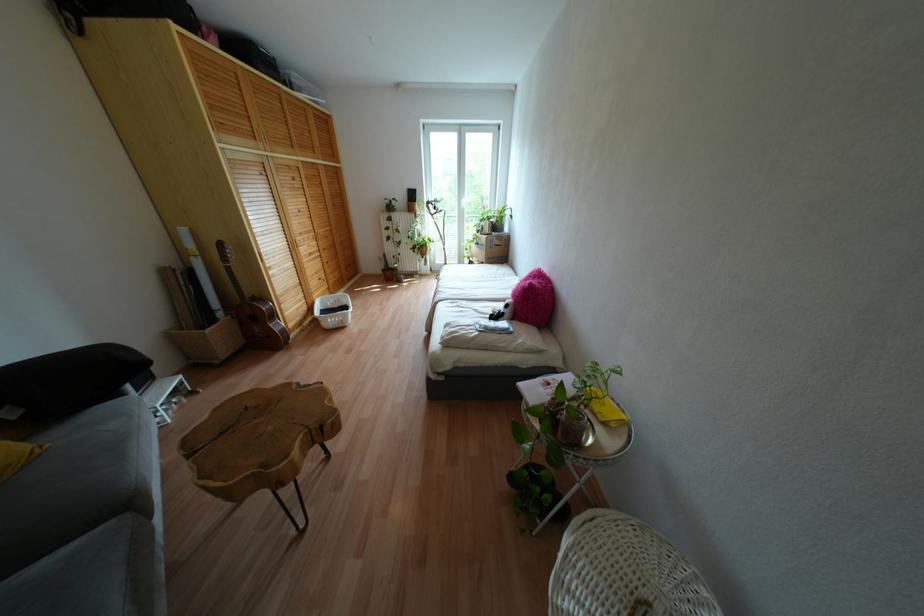
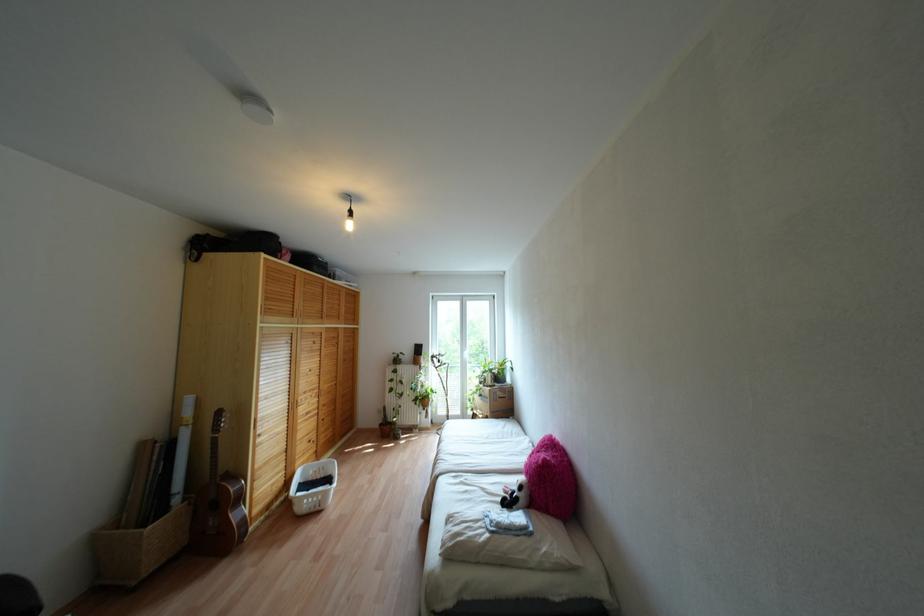
In the second image, find the point that corresponds to (x=475, y=310) in the first image.

(482, 488)